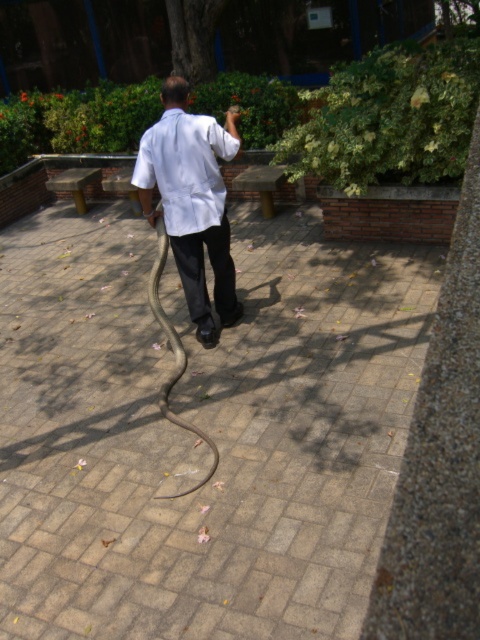
Question: Does white matte shirt at center have a larger size compared to shiny black snake at center?

Choices:
 (A) no
 (B) yes

Answer: (A)

Question: Which point is farther to the camera?

Choices:
 (A) shiny black snake at center
 (B) white matte dress shirt at center

Answer: (B)

Question: Which of the following is the closest to the observer?

Choices:
 (A) white matte shirt at center
 (B) shiny black snake at center

Answer: (B)

Question: Which object appears farthest from the camera in this image?

Choices:
 (A) white matte dress shirt at center
 (B) brick paved ground at center
 (C) shiny black snake at center

Answer: (A)

Question: Does brick paved ground at center have a larger size compared to white matte shirt at center?

Choices:
 (A) yes
 (B) no

Answer: (A)

Question: Can you confirm if white matte shirt at center is positioned above white matte dress shirt at center?

Choices:
 (A) yes
 (B) no

Answer: (B)